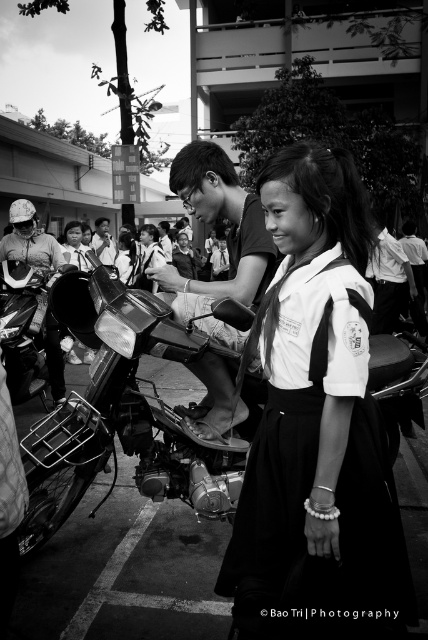
You are a photographer trying to capture a candid shot of the scene. You notice the white uniform at center and the metallic chrome motorcycle at center. Which object is positioned higher in the frame?

The white uniform at center is positioned higher in the frame than the metallic chrome motorcycle at center because the description states that the white uniform at center is above the metallic chrome motorcycle at center.

You are a photographer trying to capture a photo of the white uniform at center and the metallic chrome motorcycle at center. Which one do you need to adjust your camera focus on first if you want to focus on the closer object?

The white uniform at center is taller than the metallic chrome motorcycle at center, so the photographer should focus on the white uniform at center first since it is closer to the camera.